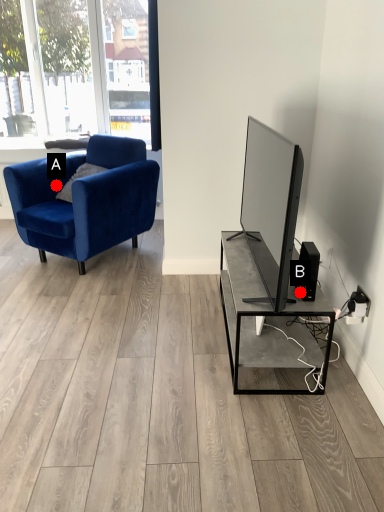
Question: Two points are circled on the image, labeled by A and B beside each circle. Which point appears closest to the camera in this image?

Choices:
 (A) A is closer
 (B) B is closer

Answer: (B)